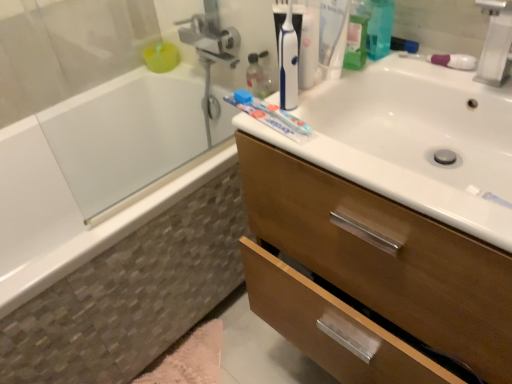
Question: From the image's perspective, relative to pink fluffy bath mat at lower left, is white frosted glass bathtub at left, which is the 2th bath in bottom-to-top order, above or below?

Choices:
 (A) above
 (B) below

Answer: (A)

Question: Considering their positions, is white frosted glass bathtub at left, positioned as the 1th bath in top-to-bottom order, located in front of or behind pink fluffy bath mat at lower left?

Choices:
 (A) front
 (B) behind

Answer: (A)

Question: Based on their relative distances, which object is farther from the white frosted glass bathtub at left, which is the 2th bath in bottom-to-top order?

Choices:
 (A) brown wood cabinet at upper center
 (B) white glossy sink at upper right
 (C) pink fluffy bath mat at lower left
 (D) white glossy bathtub at left, acting as the second bath starting from the top
 (E) white plastic faucet at upper right

Answer: (E)

Question: Which object is positioned farthest from the white glossy bathtub at left, which ranks as the 1th bath in bottom-to-top order?

Choices:
 (A) white glossy sink at upper right
 (B) pink fluffy bath mat at lower left
 (C) white frosted glass bathtub at left, positioned as the 1th bath in top-to-bottom order
 (D) brown wood cabinet at upper center
 (E) white plastic faucet at upper right

Answer: (E)